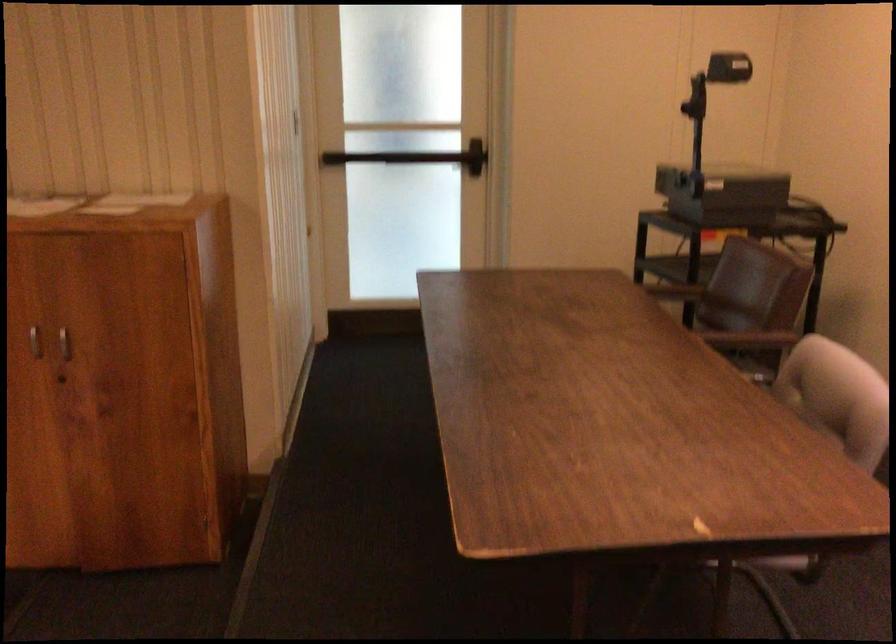
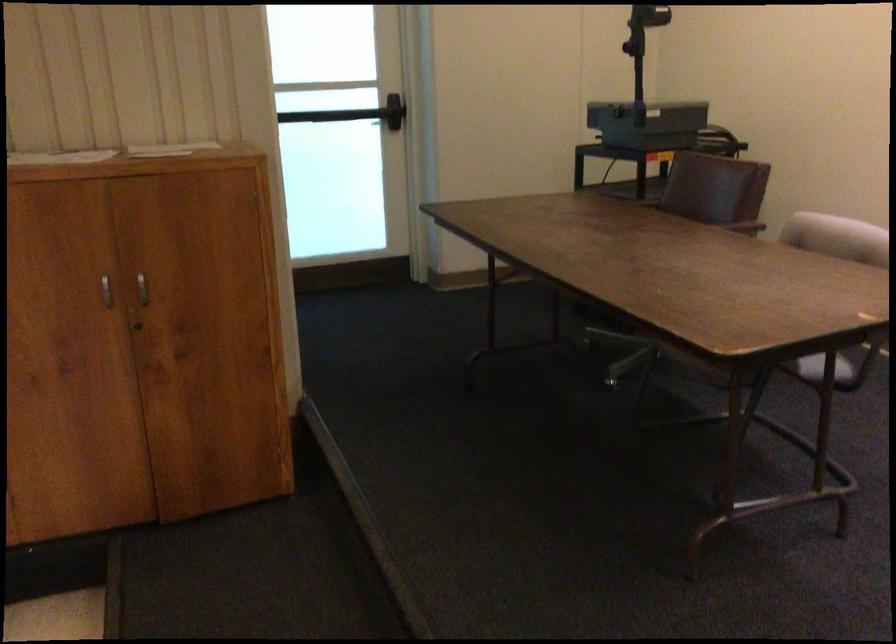
In the second image, find the point that corresponds to (769,330) in the first image.

(739, 223)